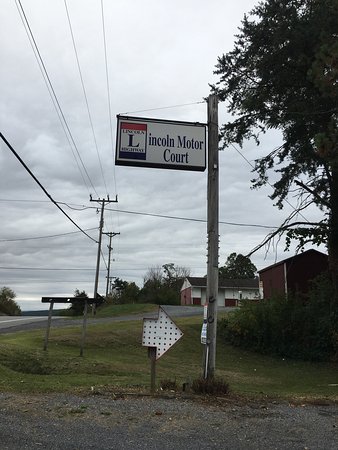
Identify the location of floor. (61, 419).